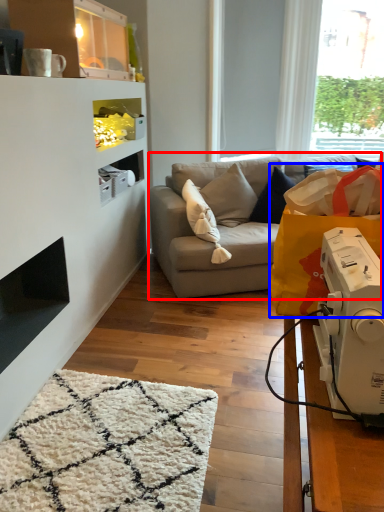
Question: Among these objects, which one is nearest to the camera, studio couch (highlighted by a red box) or grocery bag (highlighted by a blue box)?

Choices:
 (A) studio couch
 (B) grocery bag

Answer: (B)